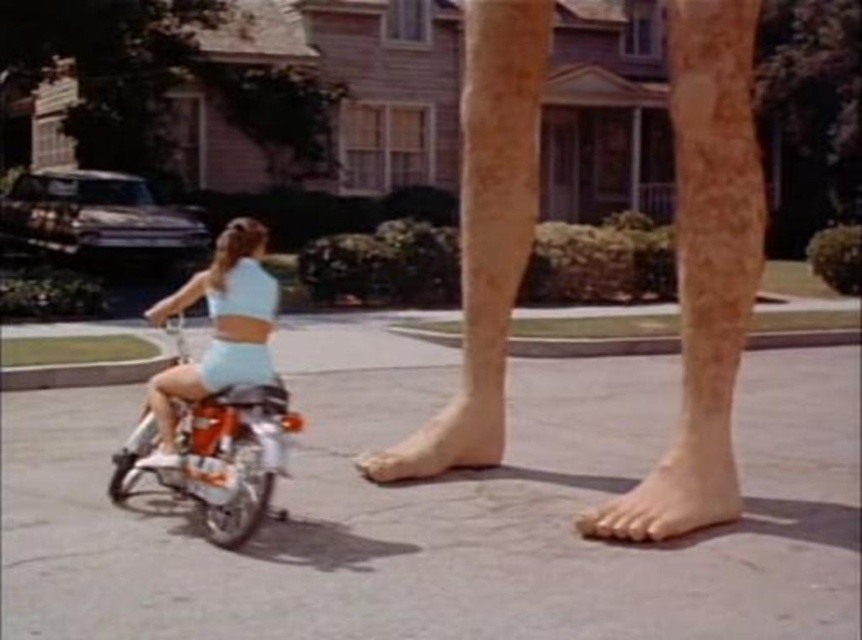
You are a GUI agent. You are given a task and a screenshot of the screen. Output one action in this format:
    pyautogui.click(x=<x>, y=<y>)
    Task: Click on the light blue fabric shorts at lower left
    The image size is (862, 640).
    Given the screenshot: What is the action you would take?
    pyautogui.click(x=217, y=330)

Is point (242, 372) more distant than point (639, 506)?

No, it is in front of (639, 506).

Between point (253, 353) and point (736, 355), which one is positioned behind?

Positioned behind is point (736, 355).

Where is `light blue fabric shorts at lower left`? light blue fabric shorts at lower left is located at coordinates (217, 330).

Which is below, orange metallic motorcycle at lower left or light blue fabric shorts at lower left?

orange metallic motorcycle at lower left

Does point (233, 435) lie behind point (238, 234)?

No, it is not.

I want to click on orange metallic motorcycle at lower left, so click(217, 456).

Does light blue fabric shorts at lower left have a lesser width compared to skinny barefoot at lower center?

Yes.

Locate an element on the screen. light blue fabric shorts at lower left is located at coordinates (217, 330).